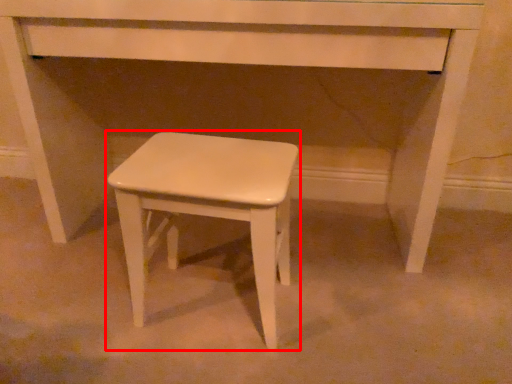
Question: From the image's perspective, where is stool (annotated by the red box) located in relation to table in the image?

Choices:
 (A) above
 (B) below

Answer: (B)